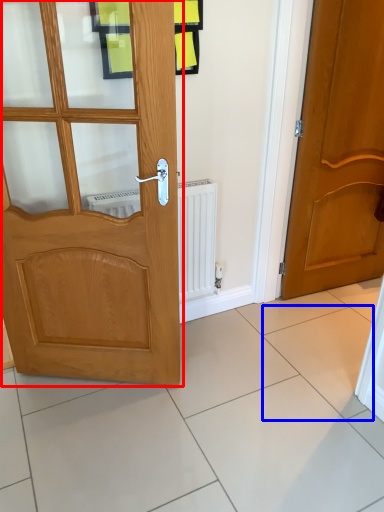
Question: Among these objects, which one is farthest to the camera, door (highlighted by a red box) or ceramic tile (highlighted by a blue box)?

Choices:
 (A) door
 (B) ceramic tile

Answer: (B)